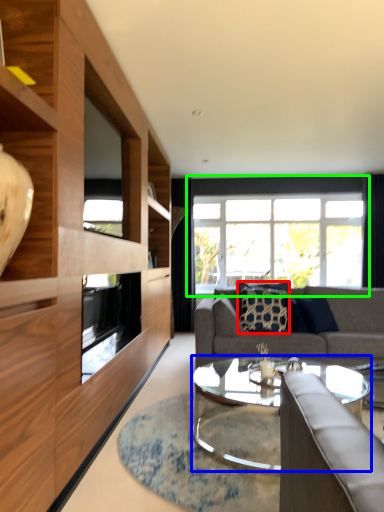
Question: Estimate the real-world distances between objects in this image. Which object is closer to pillow (highlighted by a red box), coffee table (highlighted by a blue box) or window (highlighted by a green box)?

Choices:
 (A) coffee table
 (B) window

Answer: (A)